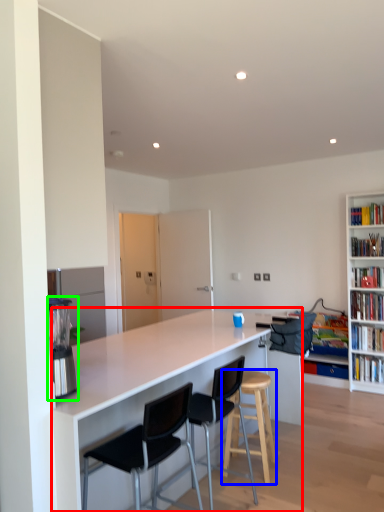
Question: Which object is the closest to the countertop (highlighted by a red box)? Choose among these: stool (highlighted by a blue box) or appliance (highlighted by a green box).

Choices:
 (A) stool
 (B) appliance

Answer: (A)